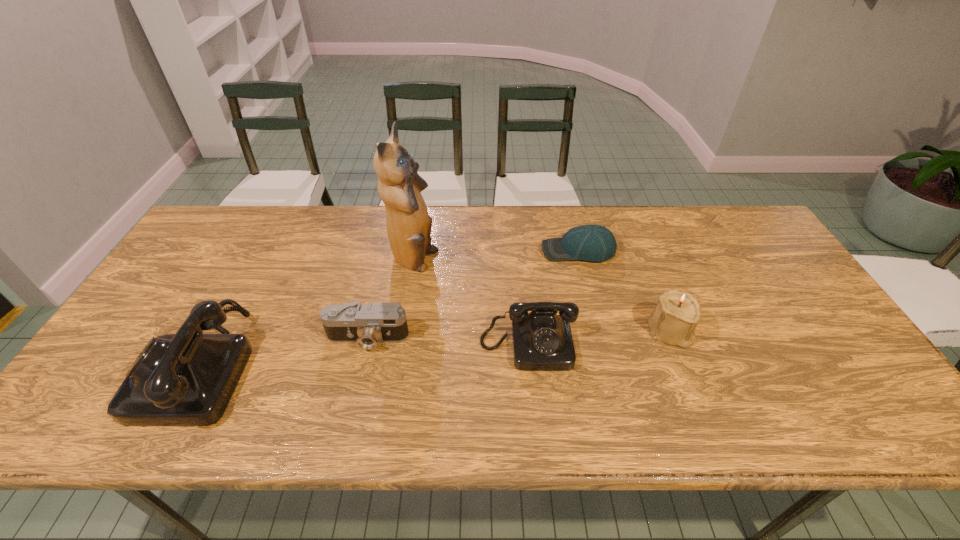
Find the location of a particular element. The width and height of the screenshot is (960, 540). vacant region at the near edge is located at coordinates (592, 385).

Image resolution: width=960 pixels, height=540 pixels. In the image, there is a desktop. Find the location of `vacant space at the left edge`. vacant space at the left edge is located at coordinates (224, 253).

Find the location of a particular element. vacant space at the right edge of the desktop is located at coordinates (814, 302).

Locate an element on the screen. vacant region at the far right corner of the desktop is located at coordinates (742, 208).

The width and height of the screenshot is (960, 540). I want to click on unoccupied area between the candle_holder and the fifth shortest object, so click(434, 348).

Locate an element on the screen. vacant point located between the taller telephone and the third shortest object is located at coordinates (364, 355).

Where is `vacant point located between the shorter telephone and the baseball cap`? Image resolution: width=960 pixels, height=540 pixels. vacant point located between the shorter telephone and the baseball cap is located at coordinates (553, 298).

This screenshot has width=960, height=540. Identify the location of free space between the rightmost object and the shorter telephone. (599, 339).

Where is `vacant space that's between the fifth shortest object and the third shortest object`? This screenshot has width=960, height=540. vacant space that's between the fifth shortest object and the third shortest object is located at coordinates (364, 355).

In order to click on free space between the cat and the camera in this screenshot , I will do `click(391, 300)`.